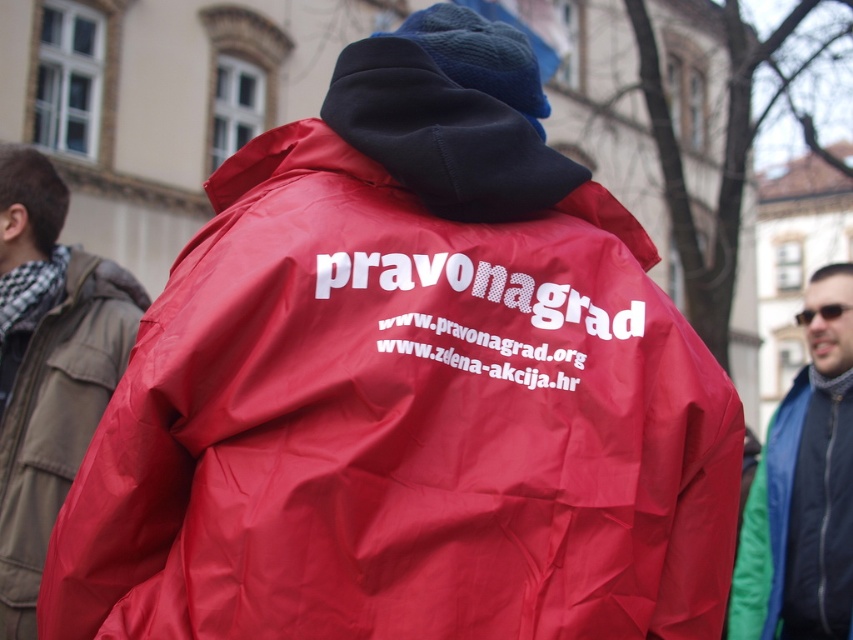
You are a fashion designer analyzing the image. You need to determine which item is longer between the matte nylon jacket at center and the sunglasses at center. Which one is longer?

The matte nylon jacket at center is shorter than sunglasses at center, so the sunglasses at center are longer.

You are standing in the scene and want to determine which of the two points, point [24,300] or point [836,316], is nearer to you. Based on the information provided, which point is closer?

Point [24,300] is closer to the viewer than point [836,316].